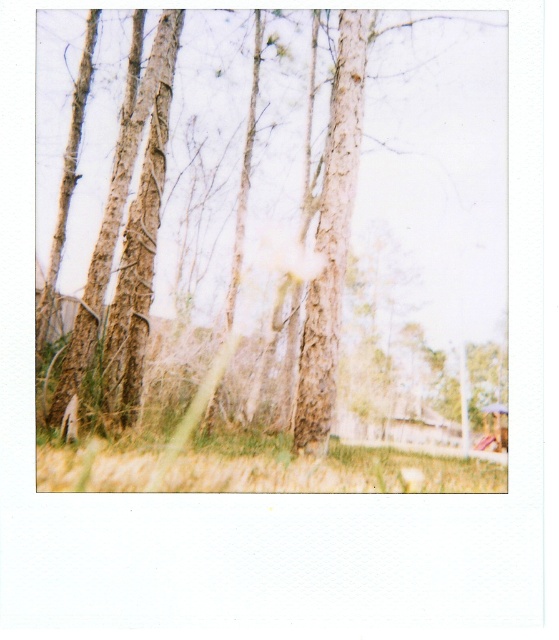
Is rough bark tree at center behind green grass at lower center?

Yes, rough bark tree at center is further from the viewer.

Can you confirm if rough bark tree at center is thinner than green grass at lower center?

No.

Who is more forward, (357, 93) or (196, 476)?

Point (196, 476) is more forward.

The image size is (559, 640). Find the location of `rough bark tree at center`. rough bark tree at center is located at coordinates (276, 225).